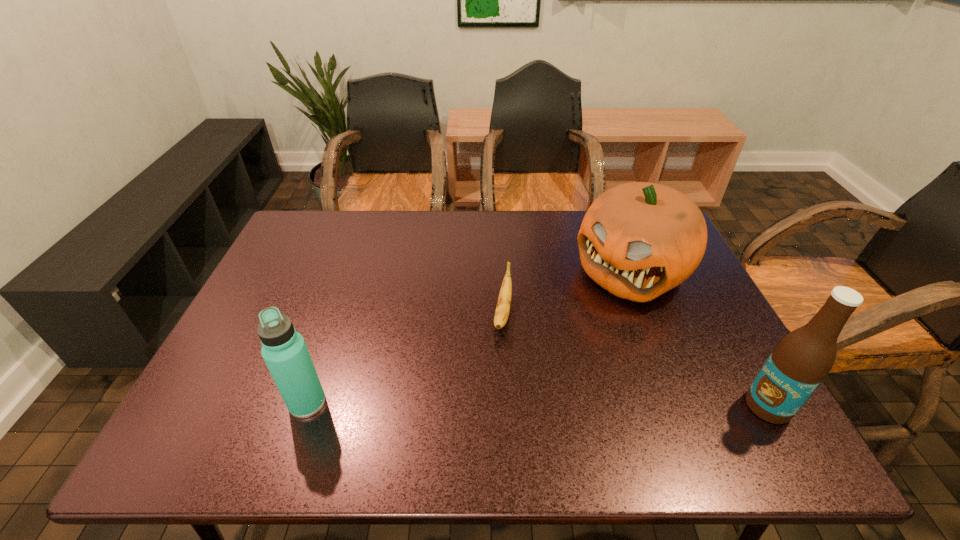
You are a GUI agent. You are given a task and a screenshot of the screen. Output one action in this format:
    pyautogui.click(x=<x>, y=<y>)
    Task: Click on the free space on the desktop that is between the leftmost object and the tallest object and is positioned on the peel of the third object from right to left from the top
    The height and width of the screenshot is (540, 960).
    Given the screenshot: What is the action you would take?
    pyautogui.click(x=485, y=404)

Locate an element on the screen. The image size is (960, 540). free space on the desktop that is between the leftmost object and the tallest object and is positioned on the face of the pumpkin is located at coordinates click(x=489, y=404).